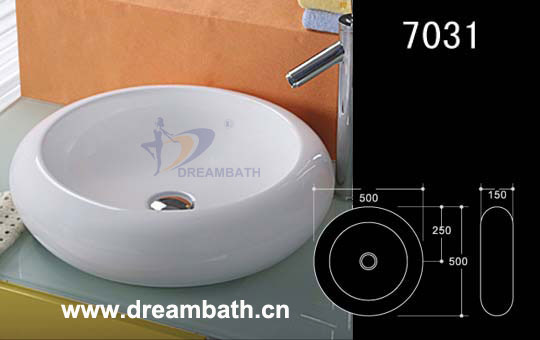
Identify the location of ceramic. (216, 214).